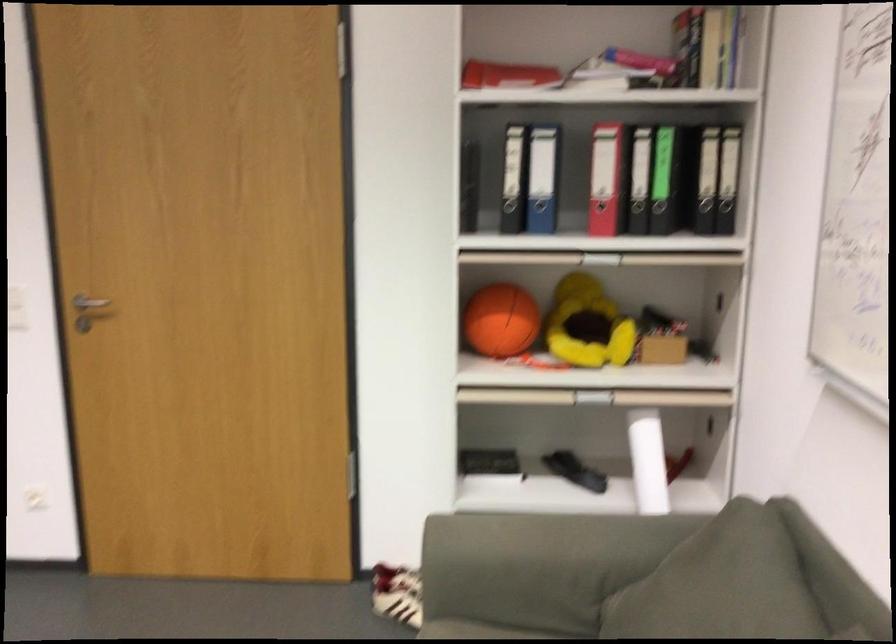
What do you see at coordinates (539, 216) in the screenshot? I see `a blue binder hole` at bounding box center [539, 216].